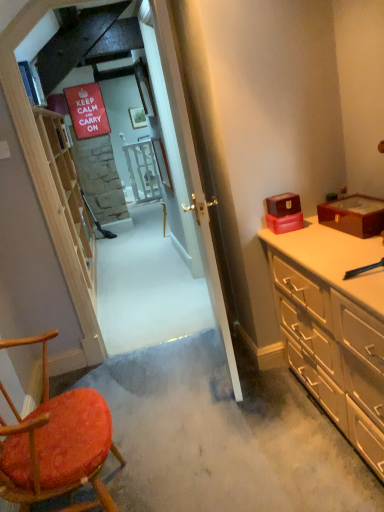
Identify the location of free space to the back side of wooden textured chair at lower left. The width and height of the screenshot is (384, 512). (144, 422).